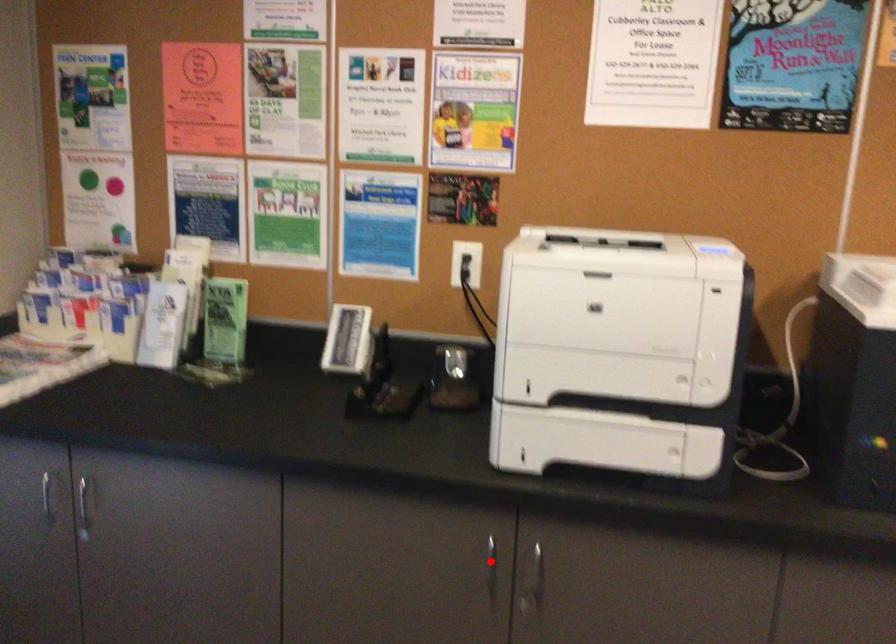
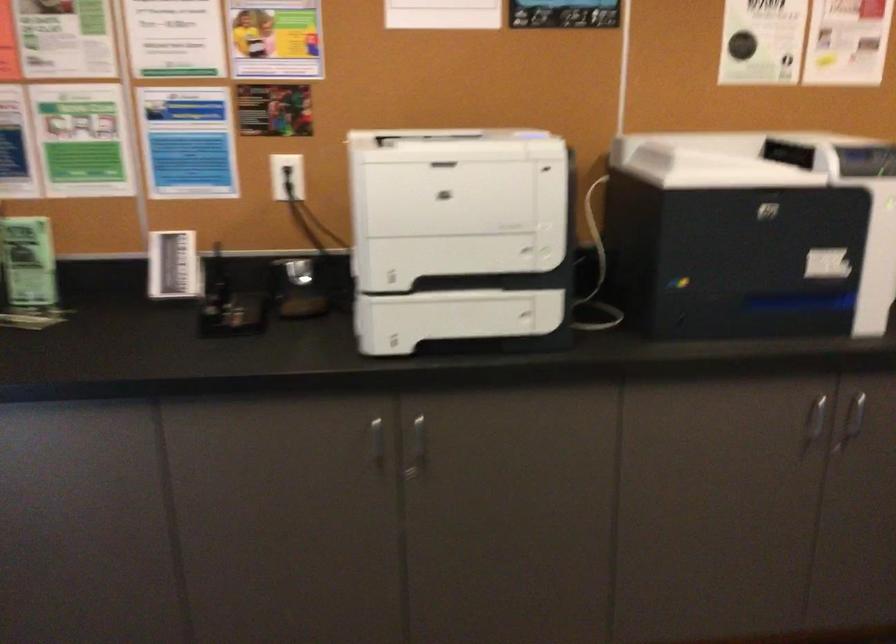
Where in the second image is the point corresponding to the highlighted location from the first image?

(376, 442)